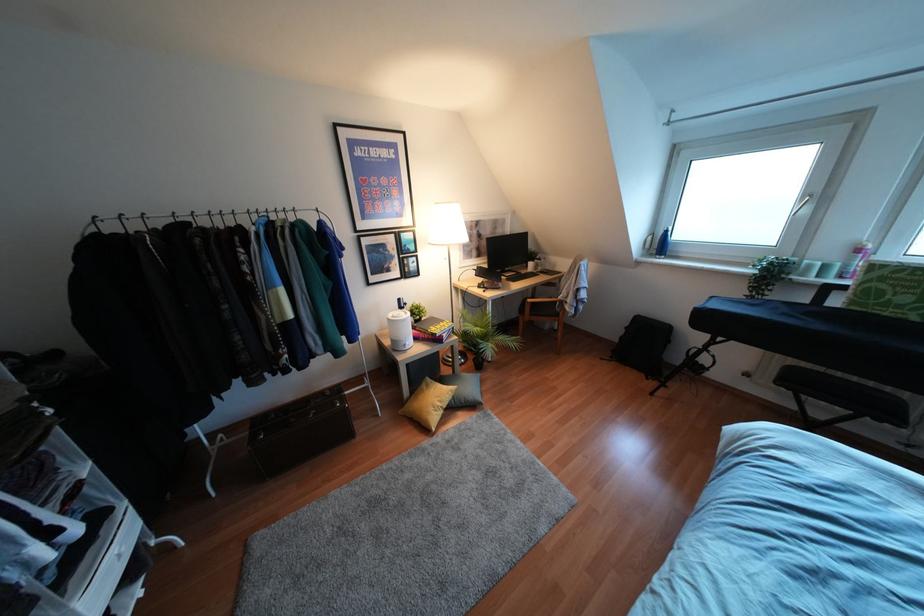
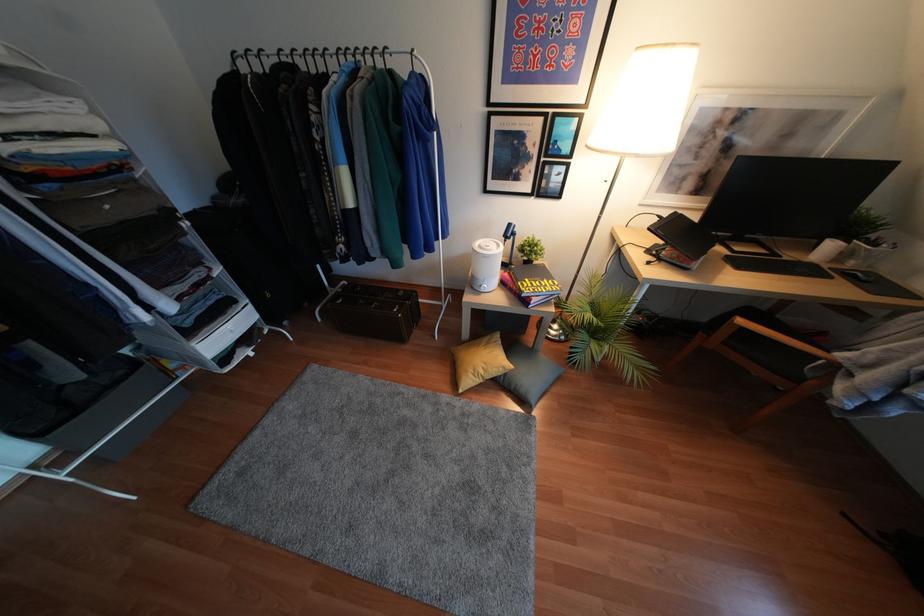
The point at (253,216) is marked in the first image. Where is the corresponding point in the second image?

(342, 59)